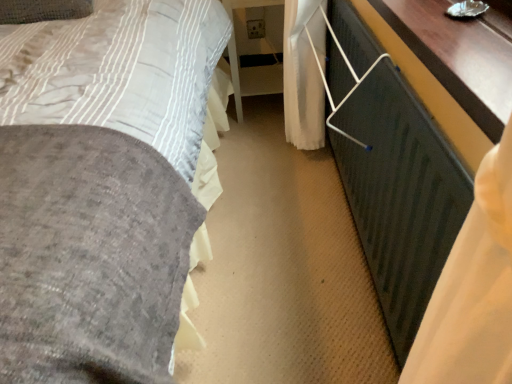
Question: Can you see wooden table at right, placed as the 1th table when sorted from front to back, touching metallic silver balustrade at lower right?

Choices:
 (A) yes
 (B) no

Answer: (B)

Question: Does wooden table at right, the first table when ordered from right to left, contain metallic silver balustrade at lower right?

Choices:
 (A) no
 (B) yes

Answer: (A)

Question: Could you tell me if wooden table at right, placed as the 1th table when sorted from front to back, is facing metallic silver balustrade at lower right?

Choices:
 (A) yes
 (B) no

Answer: (B)

Question: From a real-world perspective, does wooden table at right, placed as the 1th table when sorted from front to back, stand above metallic silver balustrade at lower right?

Choices:
 (A) no
 (B) yes

Answer: (B)

Question: Is wooden table at right, which appears as the 2th table when viewed from the back, bigger than metallic silver balustrade at lower right?

Choices:
 (A) yes
 (B) no

Answer: (B)

Question: From a real-world perspective, is wooden table at right, which is the 2th table in left-to-right order, positioned above or below white glossy table at center, the second table in the right-to-left sequence?

Choices:
 (A) above
 (B) below

Answer: (A)

Question: Is wooden table at right, which is the 2th table in left-to-right order, inside the boundaries of white glossy table at center, which is the 1th table from back to front, or outside?

Choices:
 (A) inside
 (B) outside

Answer: (B)

Question: Relative to white glossy table at center, the second table in the right-to-left sequence, is wooden table at right, placed as the 1th table when sorted from front to back, in front or behind?

Choices:
 (A) behind
 (B) front

Answer: (B)

Question: Visually, is wooden table at right, which appears as the 2th table when viewed from the back, positioned to the left or to the right of white glossy table at center, the 2th table when ordered from front to back?

Choices:
 (A) left
 (B) right

Answer: (B)

Question: Is metallic silver balustrade at lower right bigger or smaller than velvet gray bed at center?

Choices:
 (A) small
 (B) big

Answer: (A)

Question: From a real-world perspective, relative to velvet gray bed at center, is metallic silver balustrade at lower right vertically above or below?

Choices:
 (A) below
 (B) above

Answer: (B)

Question: Is point (382, 109) positioned closer to the camera than point (60, 91)?

Choices:
 (A) closer
 (B) farther

Answer: (B)

Question: From the image's perspective, relative to velvet gray bed at center, is metallic silver balustrade at lower right above or below?

Choices:
 (A) below
 (B) above

Answer: (B)

Question: In the image, is velvet gray bed at center positioned in front of or behind white glossy table at center, the second table in the right-to-left sequence?

Choices:
 (A) behind
 (B) front

Answer: (B)

Question: From a real-world perspective, is velvet gray bed at center physically located above or below white glossy table at center, the second table in the right-to-left sequence?

Choices:
 (A) below
 (B) above

Answer: (A)